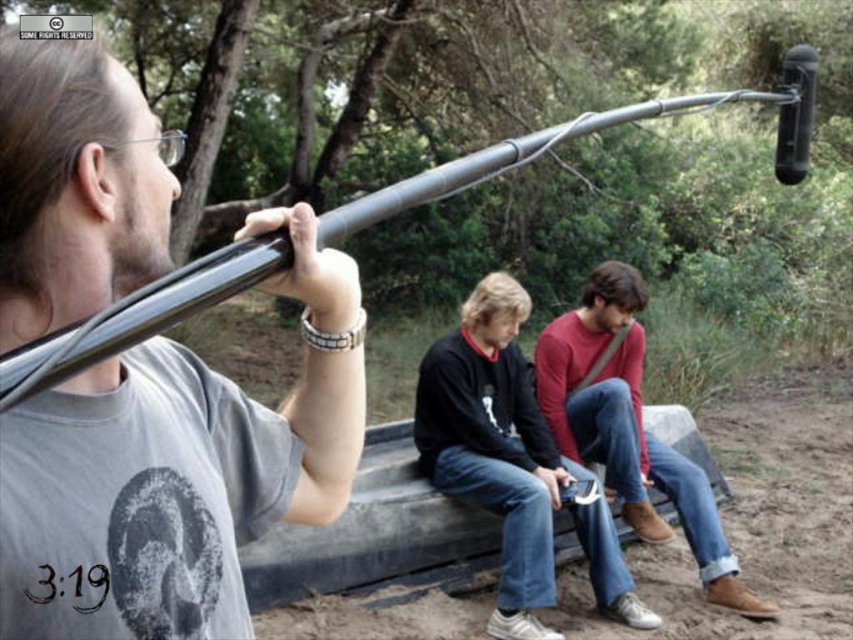
You are a photographer standing at the entrance of the forest. You want to take a photo of the matte red sweater at center and the metallic gray pole at upper left. Which object should you adjust your camera to focus on first if you want to capture both in the same frame?

The metallic gray pole at upper left is to the left of matte red sweater at center, so you should focus on the metallic gray pole at upper left first as it is positioned further to the left in the frame.

Consider the image. You are a tailor measuring two items of clothing in the image. The items are dark blue jeans at center and matte red sweater at center. Which item has a greater width?

The dark blue jeans at center has a larger width than the matte red sweater at center according to the description.

Consider the image. You are a photographer trying to capture a photo of the dark blue jeans at center. There is a metallic gray pole at upper left in the way. Can you move the pole to get a clear shot?

The metallic gray pole at upper left has a smaller size compared to dark blue jeans at center. Since the pole is smaller, you can move it out of the frame to capture the dark blue jeans at center clearly.